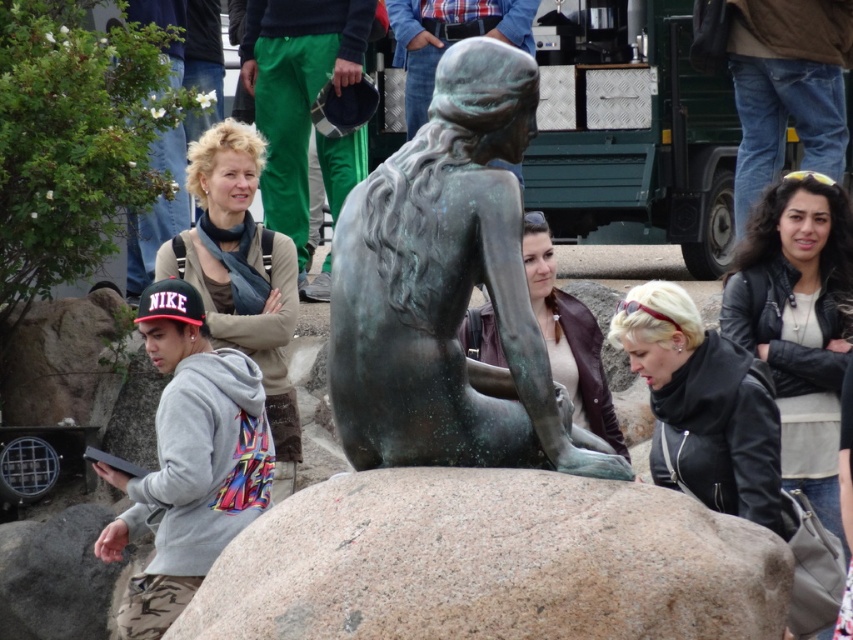
Between green patina bronze statue at center and gray fleece hoodie at lower left, which one is positioned higher?

green patina bronze statue at center is higher up.

Does green patina bronze statue at center have a larger size compared to gray fleece hoodie at lower left?

Incorrect, green patina bronze statue at center is not larger than gray fleece hoodie at lower left.

This screenshot has width=853, height=640. In order to click on green patina bronze statue at center in this screenshot , I will do `click(450, 291)`.

You are a GUI agent. You are given a task and a screenshot of the screen. Output one action in this format:
    pyautogui.click(x=<x>, y=<y>)
    Task: Click on the green patina bronze statue at center
    The image size is (853, 640).
    Given the screenshot: What is the action you would take?
    pyautogui.click(x=450, y=291)

Measure the distance between matte bronze statue at center and camera.

They are 61.20 meters apart.

Does matte bronze statue at center have a lesser width compared to bronze statue at center?

In fact, matte bronze statue at center might be wider than bronze statue at center.

You are a GUI agent. You are given a task and a screenshot of the screen. Output one action in this format:
    pyautogui.click(x=<x>, y=<y>)
    Task: Click on the matte bronze statue at center
    This screenshot has height=640, width=853.
    Given the screenshot: What is the action you would take?
    pyautogui.click(x=241, y=275)

Can you confirm if matte bronze statue at center is taller than granite boulder at lower left?

Yes, matte bronze statue at center is taller than granite boulder at lower left.

Who is more distant from viewer, (212, 257) or (62, 536)?

Point (212, 257)

Does point (270, 248) come in front of point (54, 536)?

No, (270, 248) is further to viewer.

At what (x,y) coordinates should I click in order to perform the action: click on matte bronze statue at center. Please return your answer as a coordinate pair (x, y). Looking at the image, I should click on (241, 275).